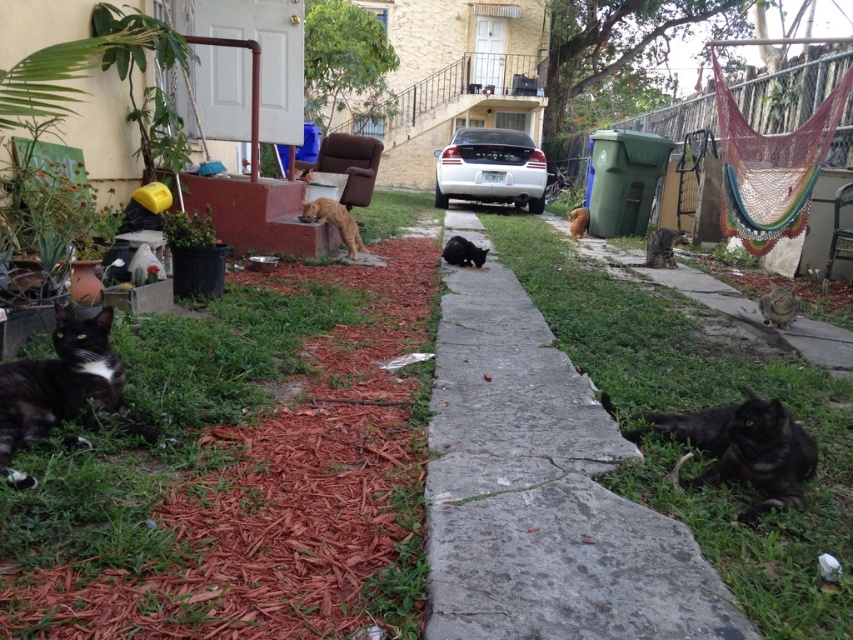
Question: Which object appears closest to the camera in this image?

Choices:
 (A) green grass at lower right
 (B) tabby fur cat at center
 (C) brown fur cat at center
 (D) silver metallic car at center

Answer: (A)

Question: Can you confirm if green grass at left is positioned to the right of black fur cat at lower right?

Choices:
 (A) no
 (B) yes

Answer: (A)

Question: From the image, what is the correct spatial relationship of black fur cat at lower left in relation to black fur cat at lower right?

Choices:
 (A) above
 (B) below

Answer: (A)

Question: Is silver metallic car at center closer to the viewer compared to tabby fur cat at lower right?

Choices:
 (A) yes
 (B) no

Answer: (B)

Question: Which point is closer to the camera?

Choices:
 (A) silver metallic car at center
 (B) black fur cat at lower left

Answer: (B)

Question: Which object is the closest to the green grass at lower right?

Choices:
 (A) green grass at left
 (B) black fur cat at lower right
 (C) black fur cat at center
 (D) tabby fur cat at center

Answer: (B)